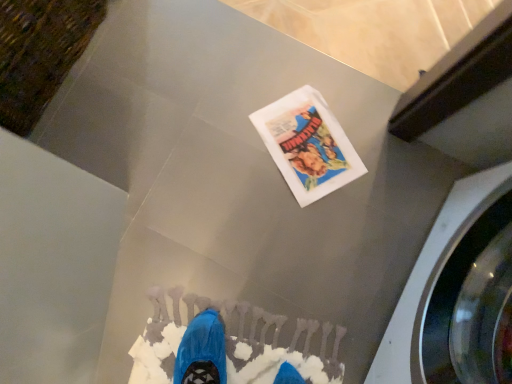
Question: Is metallic gray washing machine at right smaller than white paper flyer at center?

Choices:
 (A) no
 (B) yes

Answer: (A)

Question: Is the depth of metallic gray washing machine at right greater than that of white paper flyer at center?

Choices:
 (A) no
 (B) yes

Answer: (A)

Question: Can you confirm if metallic gray washing machine at right is positioned to the right of white paper flyer at center?

Choices:
 (A) no
 (B) yes

Answer: (B)

Question: Could white paper flyer at center be considered to be inside metallic gray washing machine at right?

Choices:
 (A) yes
 (B) no

Answer: (B)

Question: Does metallic gray washing machine at right have a lesser width compared to white paper flyer at center?

Choices:
 (A) yes
 (B) no

Answer: (B)

Question: From a real-world perspective, is metallic gray washing machine at right below white paper flyer at center?

Choices:
 (A) yes
 (B) no

Answer: (B)

Question: Is white paper flyer at center closer to the viewer compared to metallic gray washing machine at right?

Choices:
 (A) yes
 (B) no

Answer: (B)

Question: Considering the relative sizes of white paper flyer at center and metallic gray washing machine at right in the image provided, is white paper flyer at center thinner than metallic gray washing machine at right?

Choices:
 (A) no
 (B) yes

Answer: (B)

Question: Is white paper flyer at center completely or partially outside of metallic gray washing machine at right?

Choices:
 (A) yes
 (B) no

Answer: (A)

Question: Is white paper flyer at center far from metallic gray washing machine at right?

Choices:
 (A) yes
 (B) no

Answer: (B)

Question: Is white paper flyer at center bigger than metallic gray washing machine at right?

Choices:
 (A) no
 (B) yes

Answer: (A)

Question: Is white paper flyer at center oriented towards metallic gray washing machine at right?

Choices:
 (A) yes
 (B) no

Answer: (B)

Question: Is metallic gray washing machine at right wider or thinner than white paper flyer at center?

Choices:
 (A) wide
 (B) thin

Answer: (A)